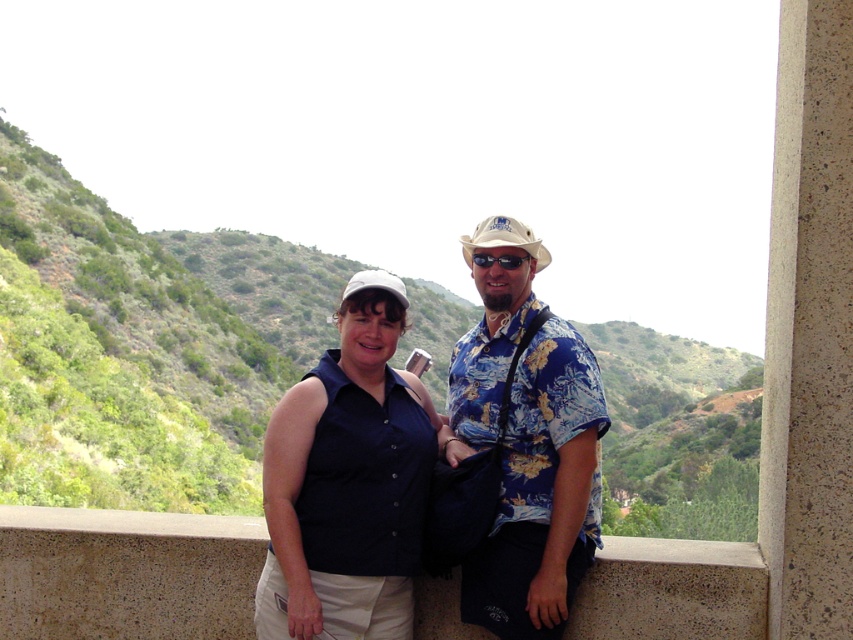
Question: Which object is closer to the camera taking this photo?

Choices:
 (A) white fabric baseball hat at upper center
 (B) dark blue button-up shirt at center
 (C) blue floral shirt at center

Answer: (C)

Question: Is dark blue button-up shirt at center positioned behind white fabric baseball hat at upper center?

Choices:
 (A) yes
 (B) no

Answer: (B)

Question: Is concrete ledge at center below white fabric baseball hat at upper center?

Choices:
 (A) yes
 (B) no

Answer: (A)

Question: Which object is positioned farthest from the floral print shirt at center?

Choices:
 (A) dark blue button-up shirt at center
 (B) black plastic goggles at center
 (C) green leafy hillside at upper left

Answer: (C)

Question: Does green leafy hillside at upper left have a smaller size compared to white fabric baseball hat at upper center?

Choices:
 (A) no
 (B) yes

Answer: (A)

Question: Which point is farther to the camera?

Choices:
 (A) (99, 276)
 (B) (296, 628)
 (C) (294, 436)
 (D) (485, 584)

Answer: (A)